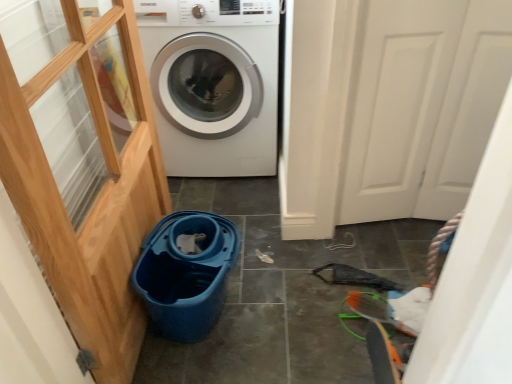
Question: From the image's perspective, is white matte door at right positioned above or below white glossy washing machine at center?

Choices:
 (A) below
 (B) above

Answer: (A)

Question: Is point (361, 79) positioned closer to the camera than point (226, 110)?

Choices:
 (A) closer
 (B) farther

Answer: (A)

Question: Estimate the real-world distances between objects in this image. Which object is farther from the blue plastic bucket at lower center?

Choices:
 (A) white glossy washing machine at center
 (B) white matte door at right

Answer: (B)

Question: Which is nearer to the white glossy washing machine at center?

Choices:
 (A) white matte door at right
 (B) blue plastic bucket at lower center

Answer: (A)